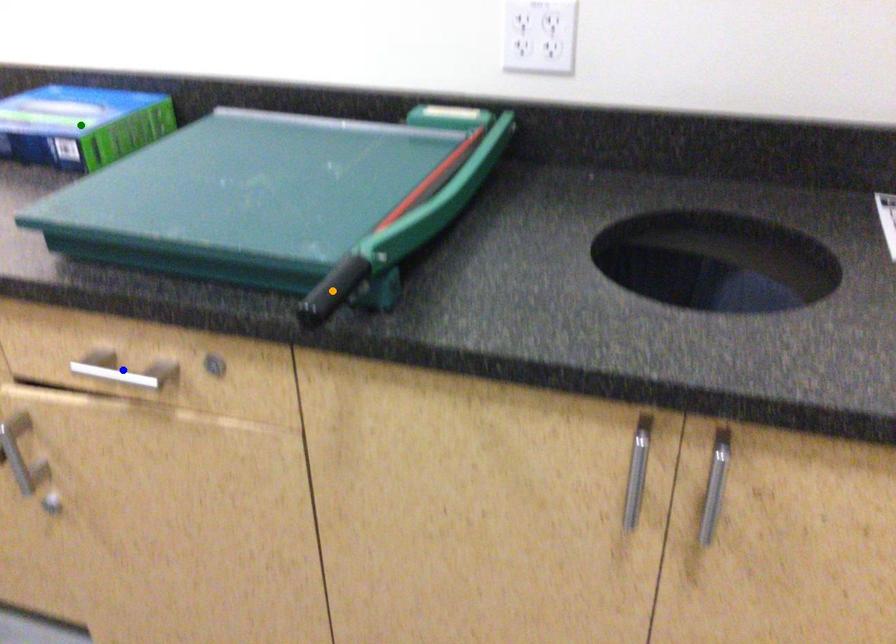
Order these from nearest to farthest:
1. orange point
2. green point
3. blue point

green point
blue point
orange point